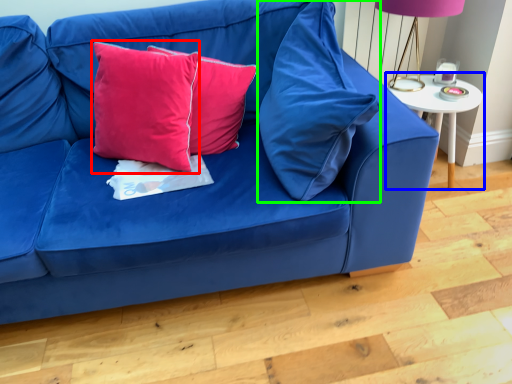
Question: Estimate the real-world distances between objects in this image. Which object is closer to pillow (highlighted by a red box), table (highlighted by a blue box) or pillow (highlighted by a green box)?

Choices:
 (A) table
 (B) pillow

Answer: (B)